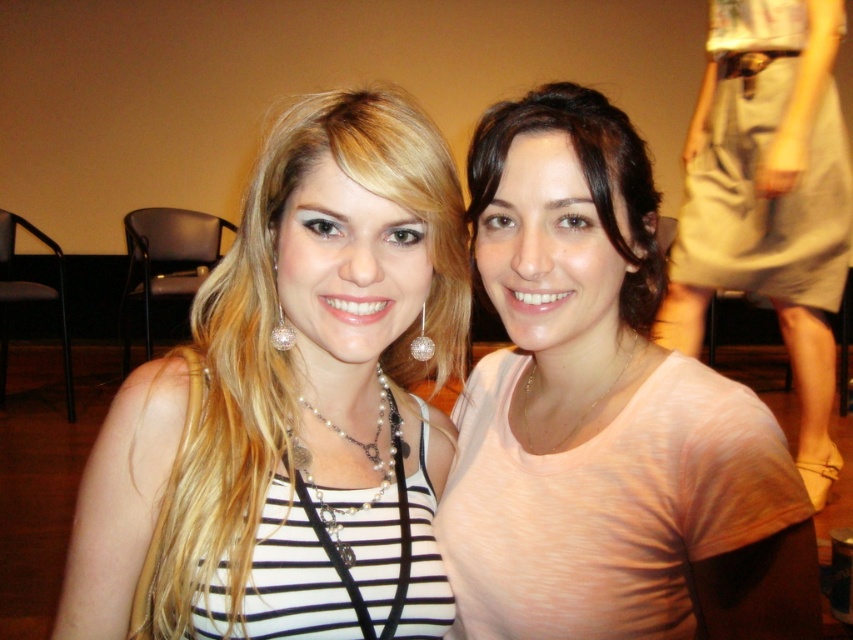
You are organizing a photoshoot and need to place two models wearing the matte black top at center and the pink matte shirt at center. Based on the scene description, which model should stand to the left of the other?

The matte black top at center should be positioned to the left of the pink matte shirt at center because according to the description, the matte black top at center is on the left side of the pink matte shirt at center.

You are a photographer adjusting your camera settings. You want to ensure the matte black top at center is in sharp focus. What is the minimum distance you should set your camera focus to capture it clearly?

The matte black top at center is 24.78 inches away from the camera. To ensure it is in sharp focus, set the camera focus to at least 24.78 inches.